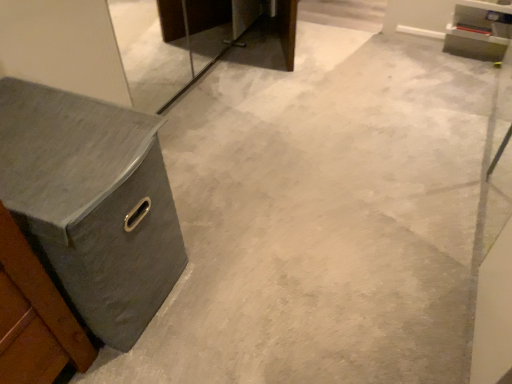
Question: Is gray fabric chest of drawers at left positioned in front of matte gray cabinet at upper right?

Choices:
 (A) no
 (B) yes

Answer: (B)

Question: Is matte gray cabinet at upper right located within gray fabric chest of drawers at left?

Choices:
 (A) yes
 (B) no

Answer: (B)

Question: Considering the relative positions of gray fabric chest of drawers at left and matte gray cabinet at upper right in the image provided, is gray fabric chest of drawers at left behind matte gray cabinet at upper right?

Choices:
 (A) yes
 (B) no

Answer: (B)

Question: Considering the relative sizes of gray fabric chest of drawers at left and matte gray cabinet at upper right in the image provided, is gray fabric chest of drawers at left shorter than matte gray cabinet at upper right?

Choices:
 (A) no
 (B) yes

Answer: (A)

Question: Can you confirm if gray fabric chest of drawers at left is wider than matte gray cabinet at upper right?

Choices:
 (A) yes
 (B) no

Answer: (A)

Question: Is gray fabric chest of drawers at left thinner than matte gray cabinet at upper right?

Choices:
 (A) no
 (B) yes

Answer: (A)

Question: From the image's perspective, would you say matte gray cabinet at upper right is positioned over gray fabric chest of drawers at left?

Choices:
 (A) yes
 (B) no

Answer: (A)

Question: Considering the relative positions of matte gray cabinet at upper right and gray fabric chest of drawers at left in the image provided, is matte gray cabinet at upper right behind gray fabric chest of drawers at left?

Choices:
 (A) yes
 (B) no

Answer: (A)

Question: Is matte gray cabinet at upper right wider than gray fabric chest of drawers at left?

Choices:
 (A) yes
 (B) no

Answer: (B)

Question: Is matte gray cabinet at upper right taller than gray fabric chest of drawers at left?

Choices:
 (A) no
 (B) yes

Answer: (A)

Question: Are matte gray cabinet at upper right and gray fabric chest of drawers at left far apart?

Choices:
 (A) no
 (B) yes

Answer: (B)

Question: Is matte gray cabinet at upper right turned away from gray fabric chest of drawers at left?

Choices:
 (A) yes
 (B) no

Answer: (B)

Question: From a real-world perspective, is matte gray cabinet at upper right above or below gray fabric chest of drawers at left?

Choices:
 (A) above
 (B) below

Answer: (B)